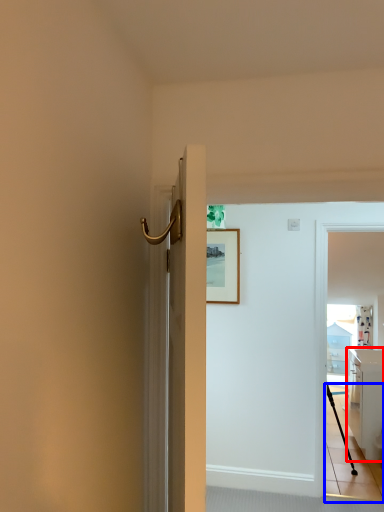
Question: Which object is closer to the camera taking this photo, cabinetry (highlighted by a red box) or path (highlighted by a blue box)?

Choices:
 (A) cabinetry
 (B) path

Answer: (B)